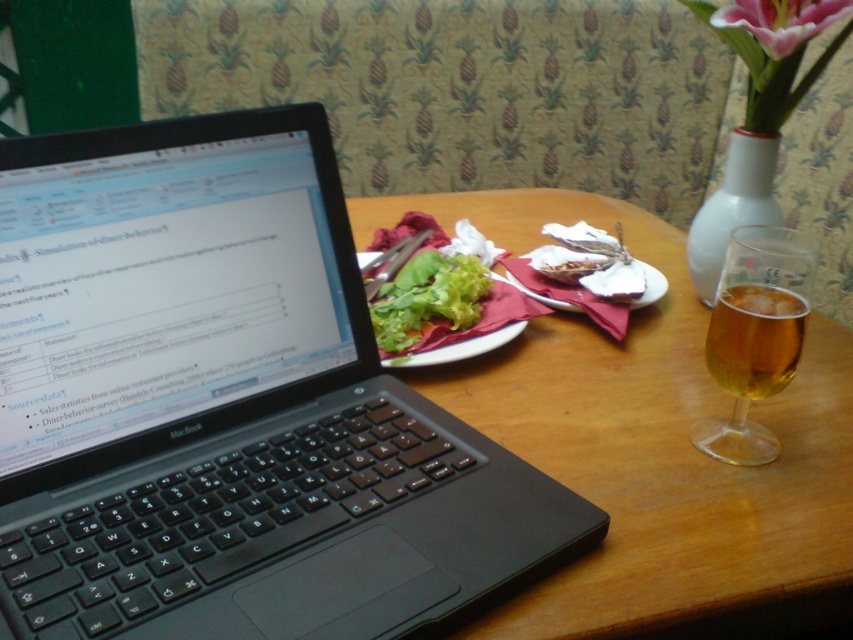
Question: Is translucent glass at right to the left of green leafy lettuce at center from the viewer's perspective?

Choices:
 (A) yes
 (B) no

Answer: (B)

Question: Which point is closer to the camera taking this photo?

Choices:
 (A) (735, 294)
 (B) (473, 282)
 (C) (730, 451)
 (D) (434, 493)

Answer: (D)

Question: Estimate the real-world distances between objects in this image. Which object is closer to the green leafy lettuce at center?

Choices:
 (A) translucent amber liquid at right
 (B) translucent glass at right
 (C) black plastic laptop at left

Answer: (C)

Question: Is green leafy lettuce at center wider than white glossy vase at upper right?

Choices:
 (A) no
 (B) yes

Answer: (B)

Question: Which object is closer to the camera taking this photo?

Choices:
 (A) green leafy lettuce at center
 (B) translucent amber liquid at right
 (C) black plastic laptop at left

Answer: (C)

Question: Is black plastic laptop at left wider than green leafy lettuce at center?

Choices:
 (A) no
 (B) yes

Answer: (B)